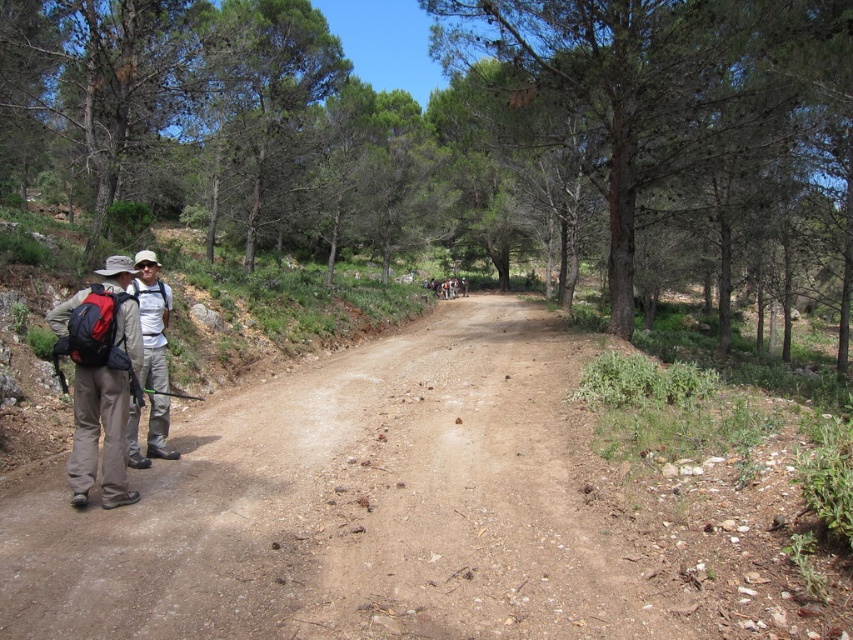
You are a hiker who needs to check if your matte black backpack at left is positioned higher than your matte khaki pants at left. Based on the scene description, can you confirm this?

The matte black backpack at left is located above the matte khaki pants at left, so yes, it is positioned higher.

You are a hiker trying to decide whether to take a break. You see the matte black backpack at left and the matte khaki pants at left. Which item is closer to you?

The matte black backpack at left is closer to you because it is in front of the matte khaki pants at left.